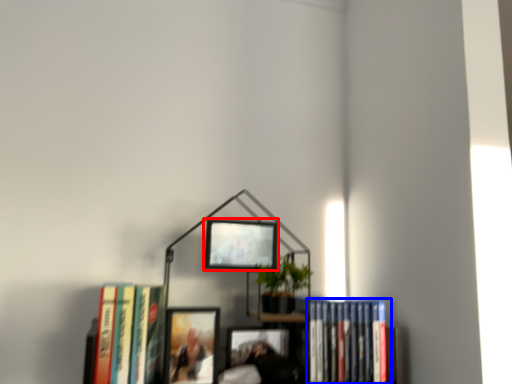
Question: Which object appears closest to the camera in this image, picture frame (highlighted by a red box) or book (highlighted by a blue box)?

Choices:
 (A) picture frame
 (B) book

Answer: (A)